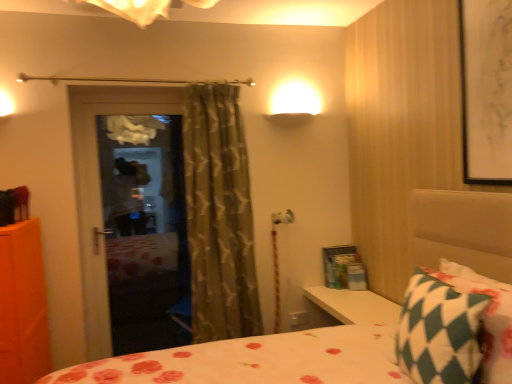
Question: From the image's perspective, is green textured curtain at center located above or below green checkered pillow at lower right?

Choices:
 (A) below
 (B) above

Answer: (B)

Question: In terms of height, does green textured curtain at center look taller or shorter compared to green checkered pillow at lower right?

Choices:
 (A) short
 (B) tall

Answer: (B)

Question: Estimate the real-world distances between objects in this image. Which object is farther from the white paper at upper right?

Choices:
 (A) green textured curtain at center
 (B) green checkered pillow at lower right

Answer: (A)

Question: Which of these objects is positioned farthest from the green textured curtain at center?

Choices:
 (A) green checkered pillow at lower right
 (B) white paper at upper right

Answer: (B)